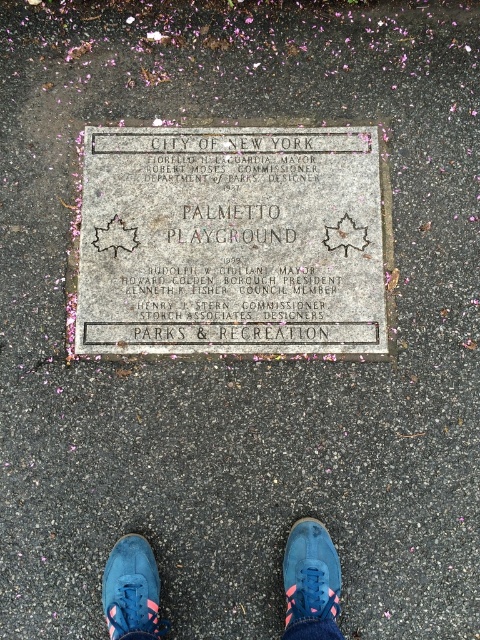
You are a city planner reviewing the layout of the sidewalk where the commemorative plaque is placed. You notice a blue suede shoe at lower center. Based on its position, can you determine if it is placed on the plaque or on the surrounding pavement?

The blue suede shoe at lower center is positioned at point [132,589]. Since the plaque is embedded in the paved surface, its exact coordinates would determine placement, but without additional spatial data, we cannot confirm if it is on the plaque or pavement.

You are standing on a sidewalk and see the gray concrete plaque at center and the blue suede shoes at center. If you want to touch both items without moving your feet, which one can you reach?

The blue suede shoes at center are closer to you than the gray concrete plaque at center, so you can reach the blue suede shoes at center without moving your feet.

You are a pedestrian walking on the sidewalk and see the gray concrete plaque at center and the blue suede shoe at lower center. Which object is located to the right of the other?

The gray concrete plaque at center is positioned on the right side of blue suede shoe at lower center.